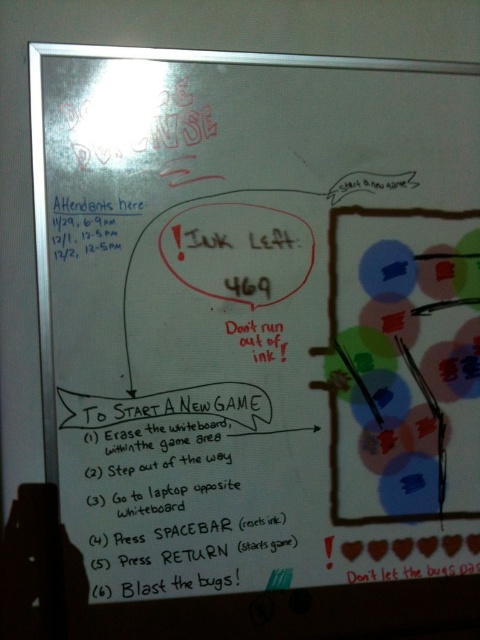
You are organizing a meeting and need to adjust the whiteboard layout. The black handwritten text at center and the black marker text at upper left are both important. If you want to move the wider text to the bottom, which one should you move?

The black handwritten text at center is wider than the black marker text at upper left, so you should move the black handwritten text at center to the bottom.

From the picture: You are organizing an event and need to check the schedule details. Looking at the whiteboard, you see the black handwritten text at center and the black marker text at upper left. Which one contains the event dates and times?

The black marker text at upper left contains the event dates and times because the black handwritten text at center is bigger than black marker text at upper left, so the smaller text at upper left likely holds the schedule details.